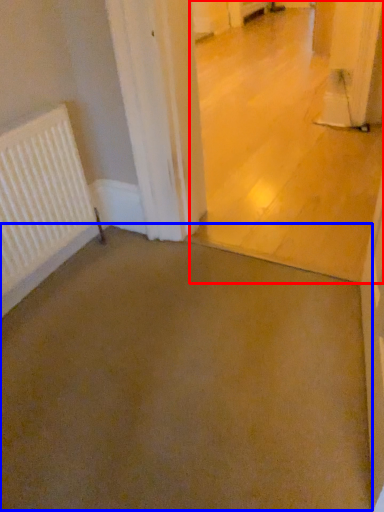
Question: Which object is closer to the camera taking this photo, concrete (highlighted by a red box) or concrete (highlighted by a blue box)?

Choices:
 (A) concrete
 (B) concrete

Answer: (B)